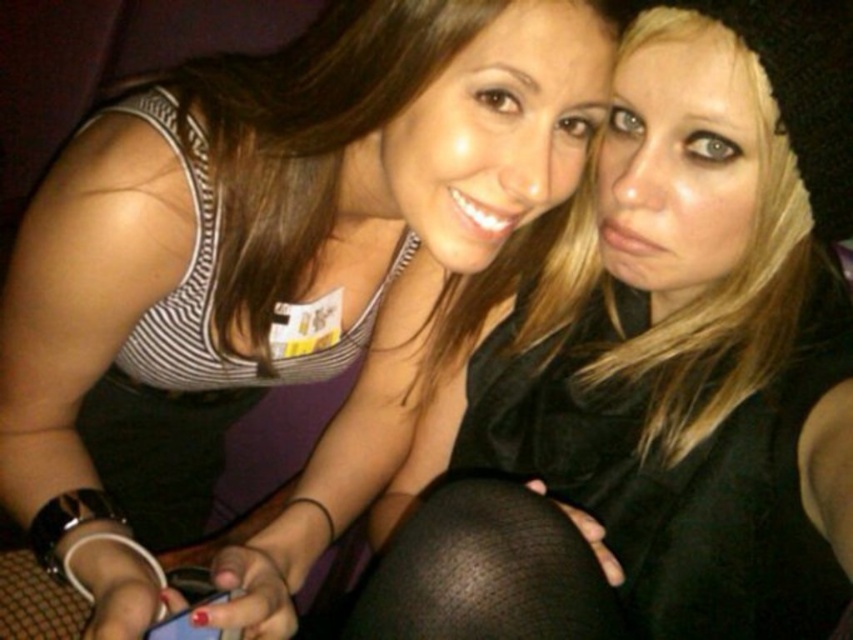
You are a photographer setting up a shot in a dimly lit bar. You notice two objects at lower center of your frame. The black mesh tights at lower center and the matte blue phone at lower center. Which object is taller in the frame?

The black mesh tights at lower center is taller than the matte blue phone at lower center according to the description.

Consider the image. You are a photographer trying to adjust the lighting in the scene. You notice the matte black leggings at lower right and the black mesh tights at lower center. Which of these two items is positioned closer to the left side of the frame?

The matte black leggings at lower right is positioned to the left of the black mesh tights at lower center, so it is closer to the left side of the frame.

You are standing in the dimly lit room where the two people are posing for a photo. You need to place a small decorative item between the two points marked as point (221, 124) and point (564, 547). Which point should the item be closer to in order to be nearer to the viewer?

The item should be closer to point (221, 124) because it is closer to the viewer than point (564, 547).